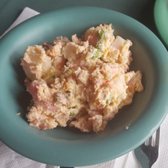
Where is `table`? The height and width of the screenshot is (168, 168). table is located at coordinates (139, 10).